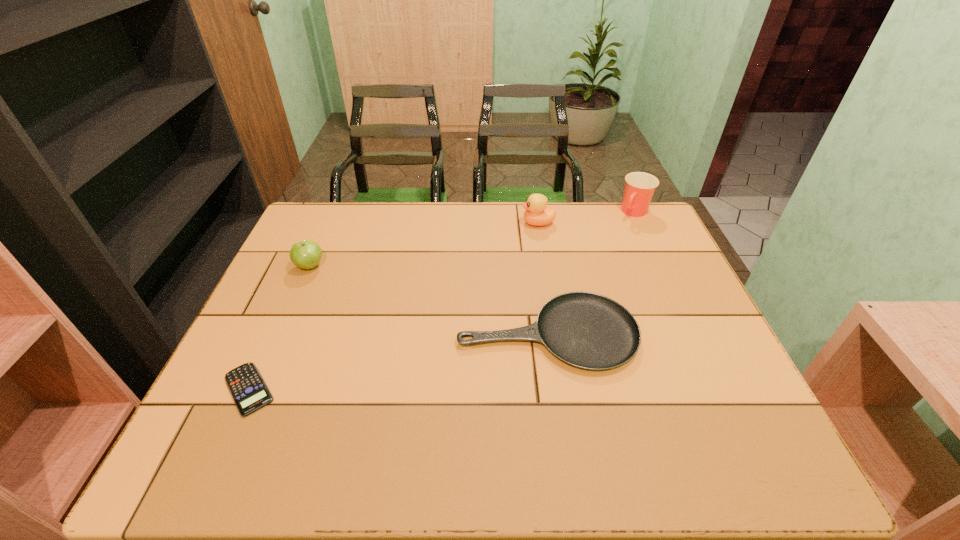
In the image, there is a desktop. Identify the location of vacant space at the left edge. (289, 272).

This screenshot has height=540, width=960. In the image, there is a desktop. In order to click on vacant space at the right edge in this screenshot , I will do `click(714, 416)`.

The width and height of the screenshot is (960, 540). I want to click on free space at the far right corner of the desktop, so click(615, 226).

Locate an element on the screen. vacant space that's between the cup and the calculator is located at coordinates (442, 301).

Locate an element on the screen. The height and width of the screenshot is (540, 960). free spot between the cup and the duckling is located at coordinates pyautogui.click(x=587, y=218).

Identify the location of free space between the apple and the calculator. This screenshot has width=960, height=540. (279, 328).

In order to click on vacant point located between the cup and the duckling in this screenshot , I will do `click(587, 218)`.

At what (x,y) coordinates should I click in order to perform the action: click on free point between the apple and the duckling. Please return your answer as a coordinate pair (x, y). The image size is (960, 540). Looking at the image, I should click on (424, 245).

You are a GUI agent. You are given a task and a screenshot of the screen. Output one action in this format:
    pyautogui.click(x=<x>, y=<y>)
    Task: Click on the vacant area that lies between the calculator and the third farthest object
    The width and height of the screenshot is (960, 540).
    Given the screenshot: What is the action you would take?
    pyautogui.click(x=279, y=328)

Where is `vacant area that lies between the duckling and the shortest object`? vacant area that lies between the duckling and the shortest object is located at coordinates (394, 306).